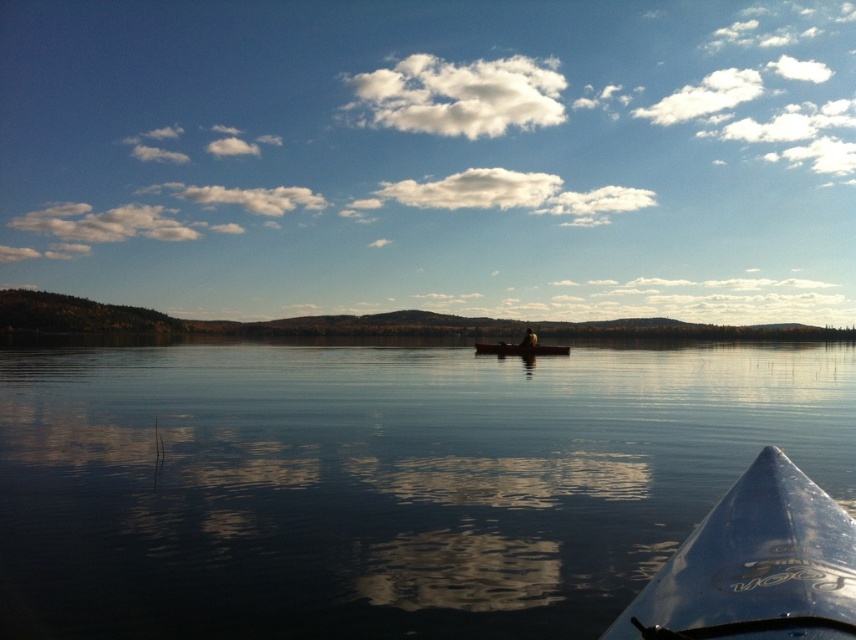
Does matte black canoe at center lie behind dark brown leather jacket at center?

Yes, matte black canoe at center is behind dark brown leather jacket at center.

Which of these two, matte black canoe at center or dark brown leather jacket at center, stands taller?

With more height is dark brown leather jacket at center.

Where is `matte black canoe at center`? Image resolution: width=856 pixels, height=640 pixels. matte black canoe at center is located at coordinates (519, 349).

Where is `matte black canoe at center`? This screenshot has width=856, height=640. matte black canoe at center is located at coordinates (519, 349).

What do you see at coordinates (379, 483) in the screenshot? Image resolution: width=856 pixels, height=640 pixels. I see `transparent water at center` at bounding box center [379, 483].

Which is in front, point (658, 372) or point (492, 353)?

Point (658, 372) is more forward.

Where is `transparent water at center`? Image resolution: width=856 pixels, height=640 pixels. transparent water at center is located at coordinates (379, 483).

Is transparent water at center above blue plastic kayak at lower right?

No.

Looking at this image, does transparent water at center lie behind blue plastic kayak at lower right?

Yes, it is behind blue plastic kayak at lower right.

Who is more distant from viewer, (43, 600) or (723, 596)?

Positioned behind is point (43, 600).

The image size is (856, 640). Identify the location of transparent water at center. (379, 483).